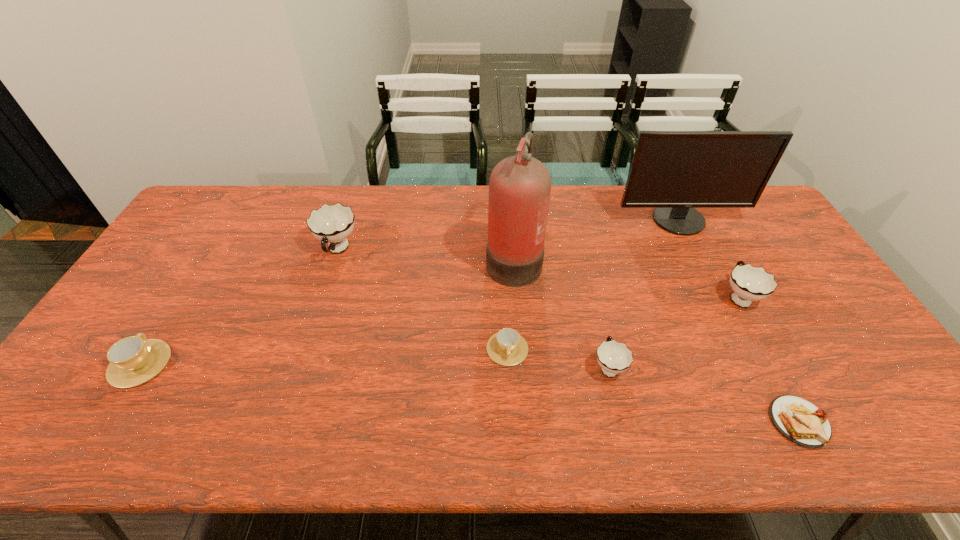
Find the location of a particular element. The width and height of the screenshot is (960, 540). unoccupied position between the leftmost object and the rightmost cup is located at coordinates (439, 330).

The width and height of the screenshot is (960, 540). Identify the location of free space between the nearest white cup and the right brown cup. (558, 357).

What are the coordinates of `free space between the third cup from right to left and the second tallest object` in the screenshot? It's located at (592, 285).

Identify the location of unoccupied position between the nearest white cup and the right brown cup. This screenshot has height=540, width=960. (558, 357).

Locate an element on the screen. free point between the fourth cup from left to right and the second tallest cup is located at coordinates (673, 332).

This screenshot has width=960, height=540. Find the location of `vacant space in between the leftmost object and the farthest white cup`. vacant space in between the leftmost object and the farthest white cup is located at coordinates (239, 307).

You are a GUI agent. You are given a task and a screenshot of the screen. Output one action in this format:
    pyautogui.click(x=<x>, y=<y>)
    Task: Click on the free area in between the second smallest white cup and the tallest object
    
    Given the screenshot: What is the action you would take?
    pyautogui.click(x=626, y=278)

Where is `free space between the fourth tallest object and the bigger brown cup`? This screenshot has width=960, height=540. free space between the fourth tallest object and the bigger brown cup is located at coordinates (439, 330).

Locate an element on the screen. free space between the rightmost white cup and the monitor is located at coordinates (708, 258).

The height and width of the screenshot is (540, 960). In order to click on vacant area that lies between the second farthest cup and the monitor in this screenshot , I will do `click(708, 258)`.